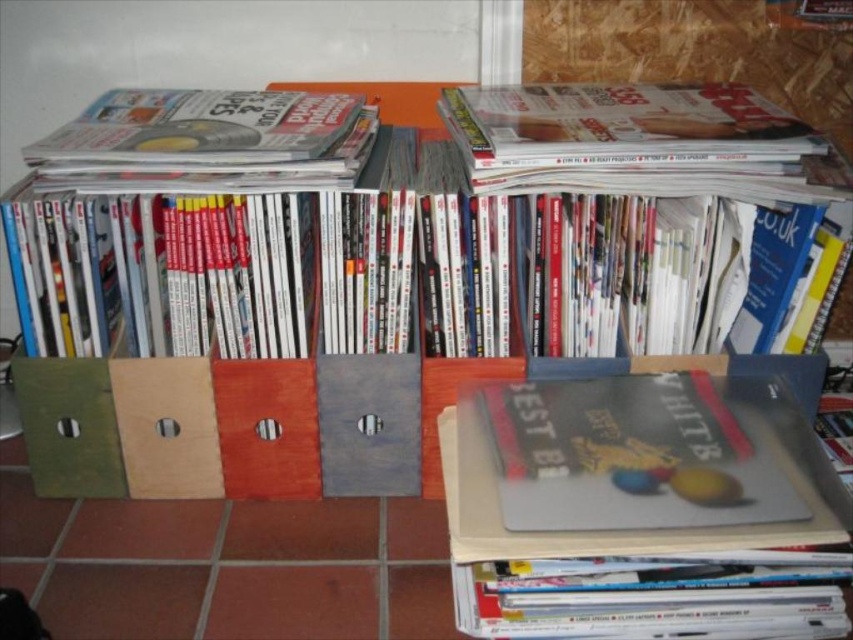
You are organizing items in a storage area and need to place a new item. The wooden bookshelf at center and the matte gray book at center are both in your way. Which one is taller and would block your view more if you stand in front of them?

The wooden bookshelf at center is much taller than the matte gray book at center, so it would block your view more if you stand in front of them.

You are a librarian who needs to place a new book that is 10 inches thick onto the wooden bookshelf at center. Can the matte black book at center be moved to accommodate the new book?

The distance between the wooden bookshelf at center and the matte black book at center is 9.21 inches. Since the new book is 10 inches thick, there isn not enough space to place it without moving the matte black book at center.